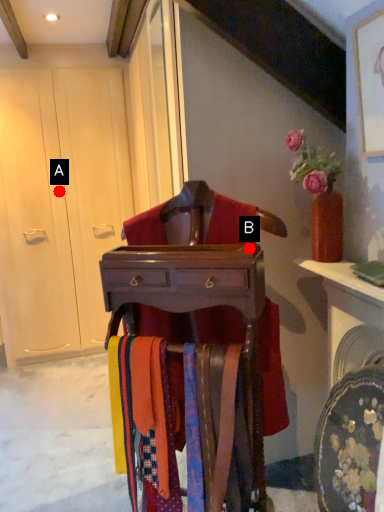
Question: Two points are circled on the image, labeled by A and B beside each circle. Which point is further to the camera?

Choices:
 (A) A is further
 (B) B is further

Answer: (A)